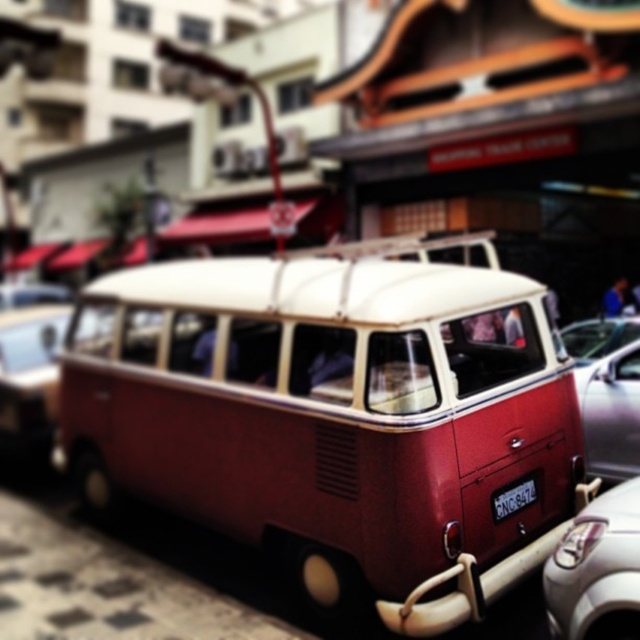
Question: Does matte red bus at center appear on the right side of white glossy car at lower right?

Choices:
 (A) no
 (B) yes

Answer: (A)

Question: Can you confirm if matte red bus at center is positioned above white glossy car at lower right?

Choices:
 (A) yes
 (B) no

Answer: (A)

Question: Which of the following is the farthest from the observer?

Choices:
 (A) metallic silver car at right
 (B) white glossy car at lower right
 (C) black plastic license plate at center

Answer: (A)

Question: Among these objects, which one is nearest to the camera?

Choices:
 (A) metallic silver car at right
 (B) matte red bus at center
 (C) white glossy car at lower right

Answer: (C)

Question: Which object is positioned closest to the matte red bus at center?

Choices:
 (A) white glossy car at lower right
 (B) metallic silver car at right

Answer: (A)

Question: Can you confirm if matte red bus at center is bigger than white glossy car at lower right?

Choices:
 (A) yes
 (B) no

Answer: (A)